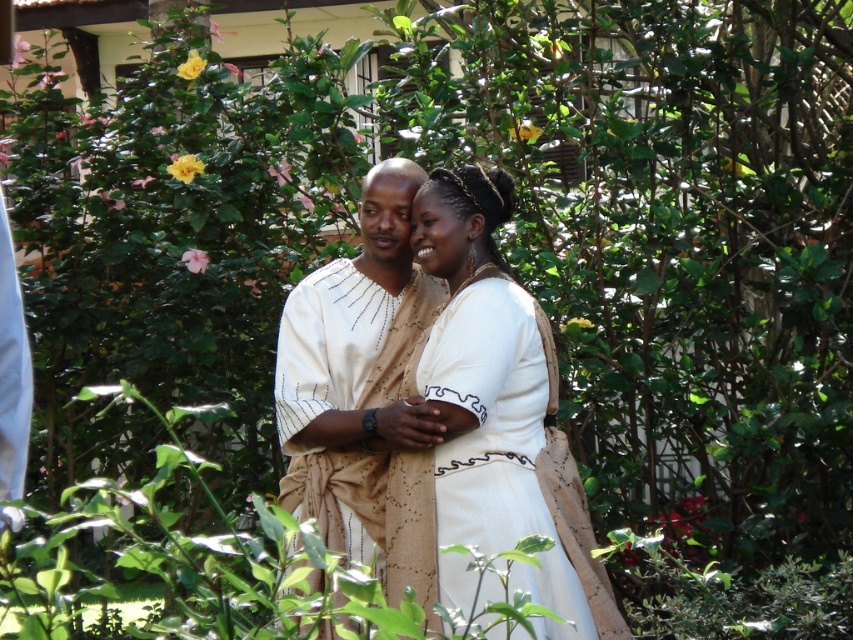
You are a photographer trying to capture the couple in the image. You want to place a decorative frame around the white textured dress at center and the beige textured robe at center. If the frame can only highlight one side of the dress, which side should you choose to ensure it aligns with the robe?

The white textured dress at center is positioned on the right side of beige textured robe at center, so you should highlight the left side of the dress to align it with the robe.

You are a photographer trying to capture a clear shot of both the white textured dress at center and the beige textured robe at center. Since the camera can only focus on one height at a time, which object should you focus on to ensure the taller one is in focus?

The white textured dress at center is much taller than the beige textured robe at center, so you should focus on the white textured dress at center to ensure the taller one is in focus.